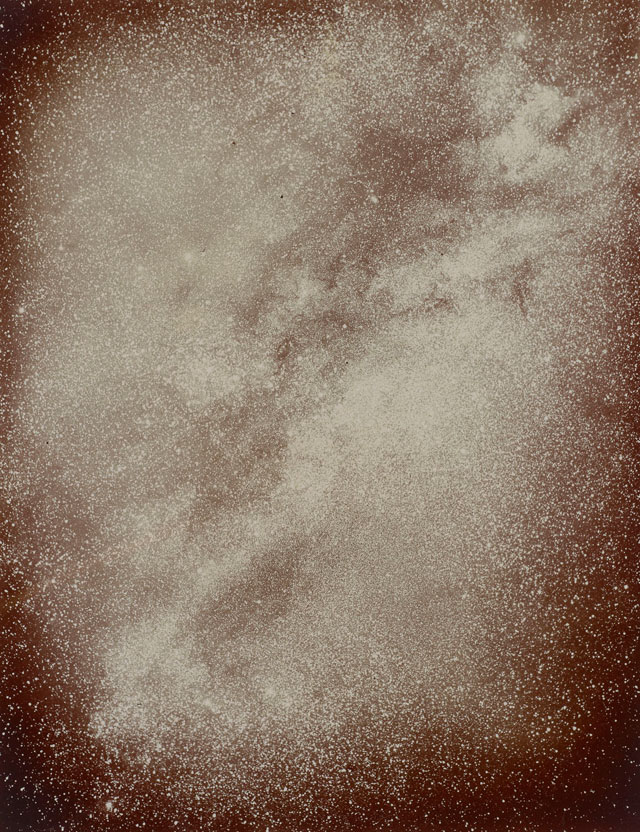
Identify the location of dust. This screenshot has height=832, width=640. (342, 447).